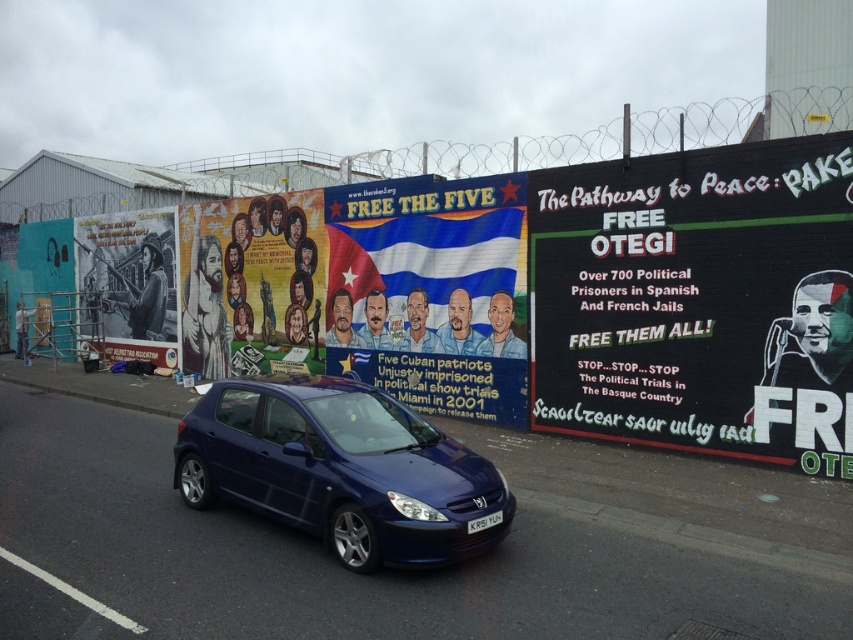
Based on the photo, you are a photographer planning to capture both the black matte billboard at right and the blue fabric poster at center in a single frame. Which object should you position closer to the edge of the frame to ensure both fit without cropping?

The black matte billboard at right is thinner than the blue fabric poster at center, so you should position the black matte billboard at right closer to the edge of the frame to ensure both fit without cropping.